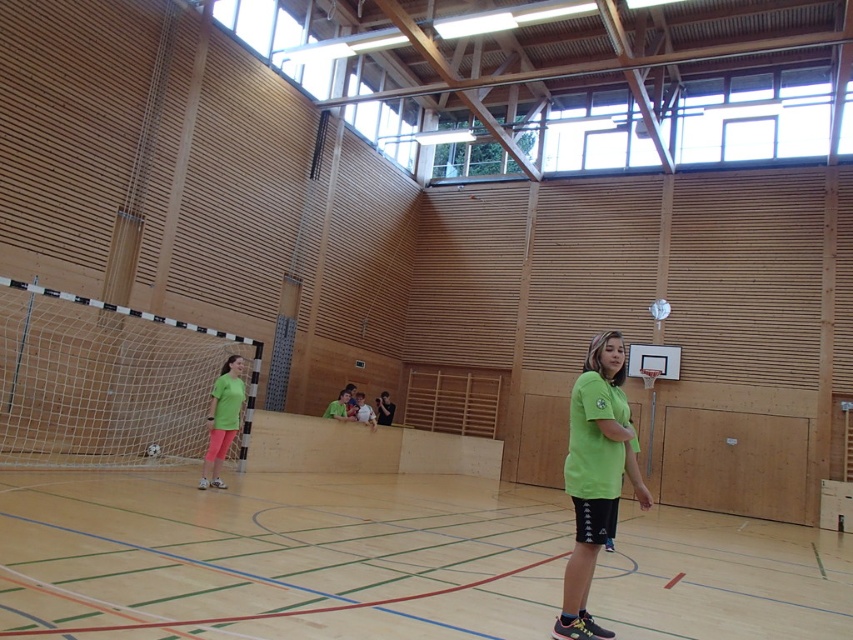
You are standing at the entrance of the sports hall and see the wooden basketball court at center and the green matte shirt at lower left. Which object is located to the right of the other?

The wooden basketball court at center is positioned on the right side of green matte shirt at lower left.

You are a photographer standing at the back of the sports hall. You want to take a photo that includes both the wooden basketball court at center and the green matte shirt at lower left. Which object should you adjust your camera angle to focus on first to ensure both are in frame?

Since the wooden basketball court at center is taller than the green matte shirt at lower left, you should focus on the wooden basketball court at center first to ensure its full height is captured, allowing the green matte shirt at lower left to naturally fit into the frame below.